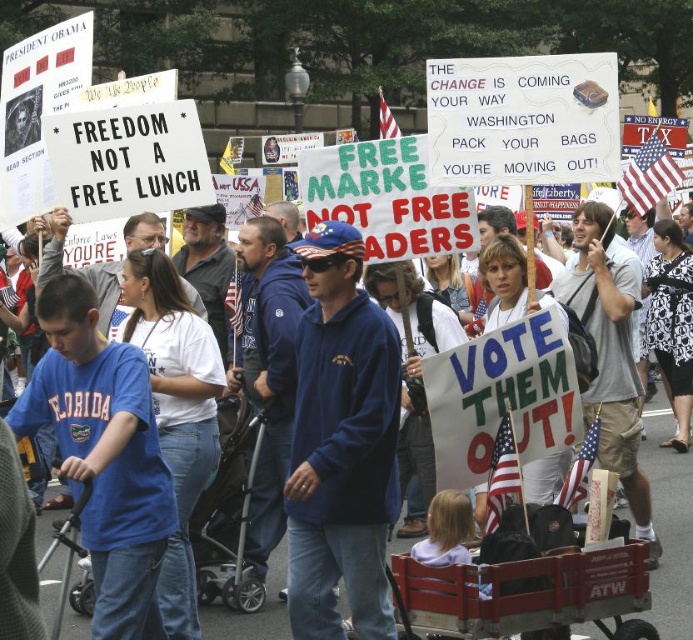
Question: Can you confirm if blue fleece jacket at center is positioned below blue sweatshirt at center?

Choices:
 (A) no
 (B) yes

Answer: (A)

Question: Is blue fleece jacket at center above blue cotton shirt at center?

Choices:
 (A) no
 (B) yes

Answer: (B)

Question: Does blue fleece jacket at center have a smaller size compared to blue cotton shirt at center?

Choices:
 (A) yes
 (B) no

Answer: (B)

Question: Which point is closer to the camera?

Choices:
 (A) blue fleece jacket at center
 (B) blue sweatshirt at center
 (C) blue cotton shirt at center

Answer: (C)

Question: Which point is closer to the camera taking this photo?

Choices:
 (A) (349, 595)
 (B) (685, 524)
 (C) (132, 467)

Answer: (C)

Question: Which point is closer to the camera?

Choices:
 (A) (98, 552)
 (B) (40, 532)
 (C) (360, 572)

Answer: (A)